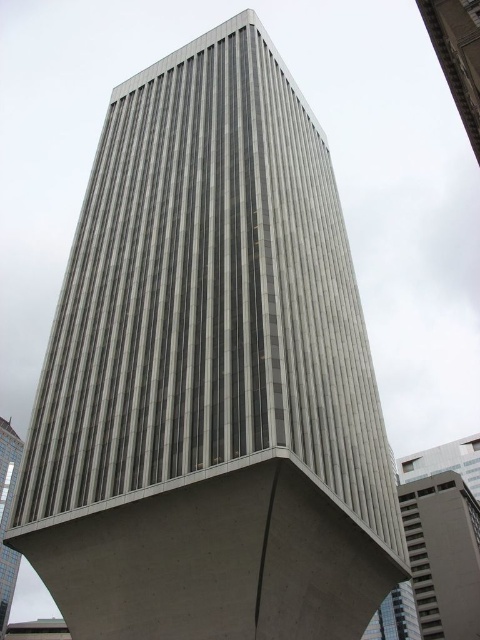
Between point (441, 20) and point (11, 582), which one is positioned in front?

Point (441, 20) is more forward.

Can you confirm if gray concrete tower at upper right is bigger than gray concrete tower at center?

Actually, gray concrete tower at upper right might be smaller than gray concrete tower at center.

Find the location of a particular element. Image resolution: width=480 pixels, height=640 pixels. gray concrete tower at upper right is located at coordinates (457, 54).

Does gray concrete building at right have a greater height compared to gray concrete tower at upper right?

Yes, gray concrete building at right is taller than gray concrete tower at upper right.

Does gray concrete building at right have a larger size compared to gray concrete tower at upper right?

Correct, gray concrete building at right is larger in size than gray concrete tower at upper right.

Identify the location of gray concrete building at right. The width and height of the screenshot is (480, 640). (443, 554).

Locate an element on the screen. The width and height of the screenshot is (480, 640). gray concrete building at right is located at coordinates (443, 554).

Is point (423, 541) positioned after point (0, 440)?

No.

Does gray concrete building at right come in front of gray concrete tower at center?

Yes.

Between point (442, 621) and point (4, 611), which one is positioned behind?

Positioned behind is point (4, 611).

Locate an element on the screen. The image size is (480, 640). gray concrete building at right is located at coordinates (443, 554).